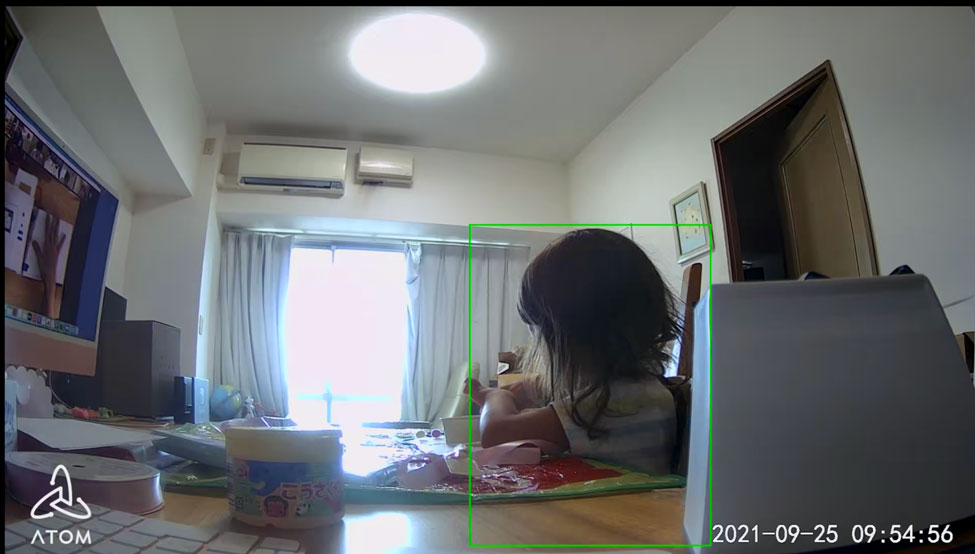
Locate an element on the screen. jar is located at coordinates (259, 471).